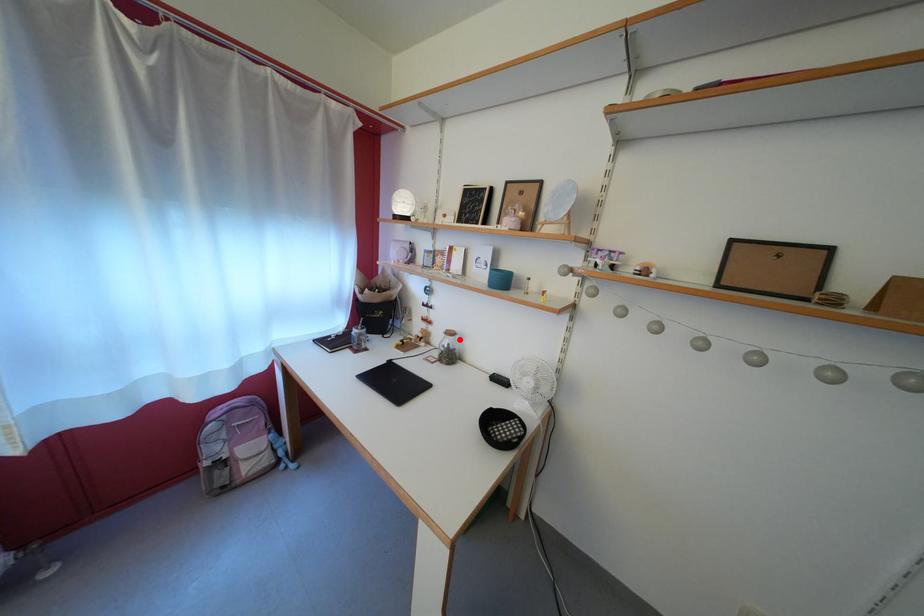
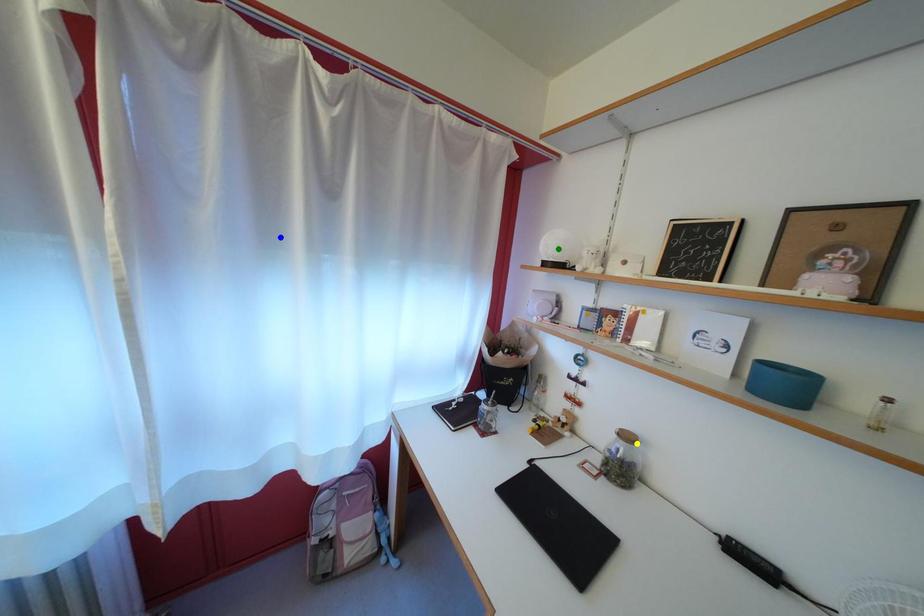
Question: I am providing you with two images of the same scene from different viewpoints. A red point is marked on the first image. You are given multiple points on the second image. Can you choose the point in image 2 that corresponds to the point in image 1?

Choices:
 (A) green point
 (B) yellow point
 (C) blue point

Answer: (B)